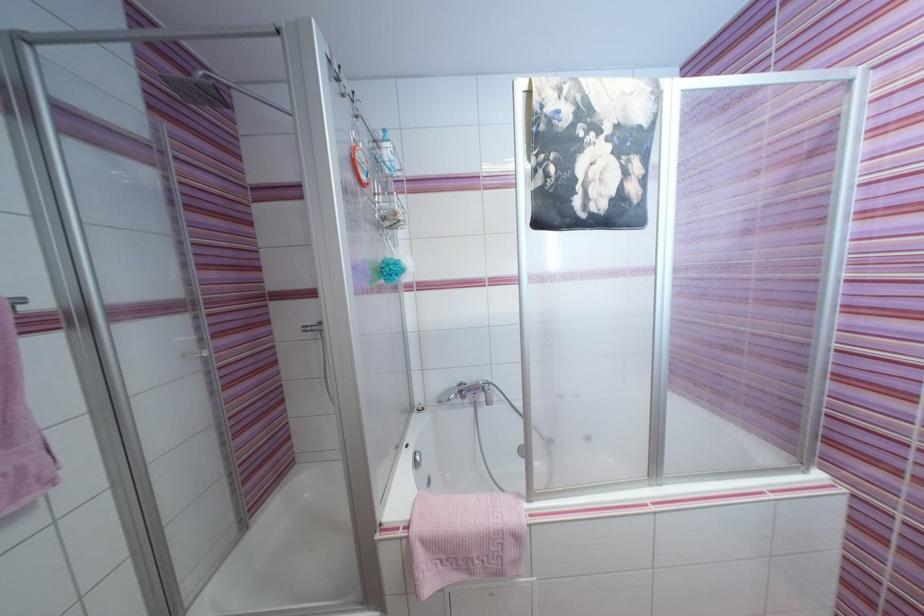
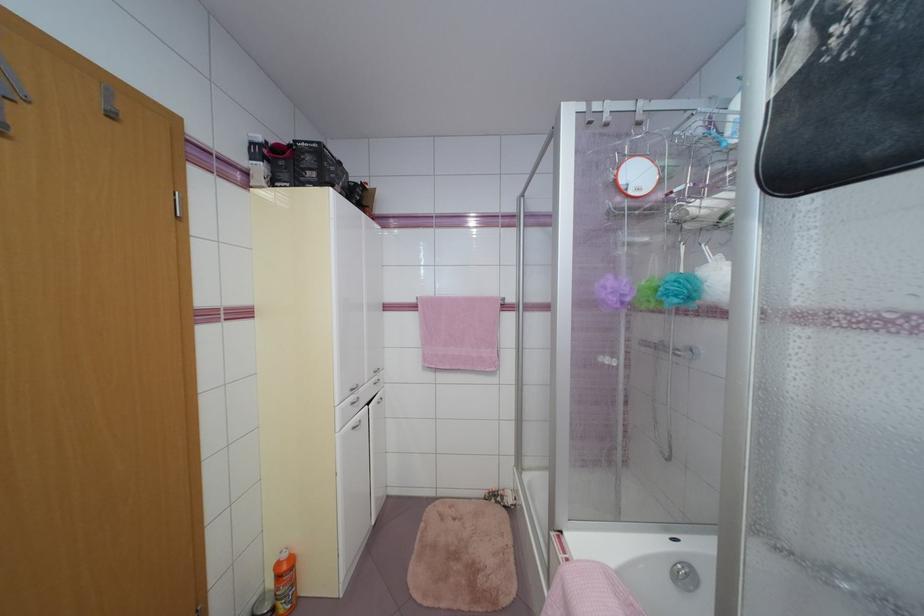
Question: The camera is either moving clockwise (left) or counter-clockwise (right) around the object. The first image is from the beginning of the video and the second image is from the end. Is the camera moving left or right when shooting the video?

Choices:
 (A) Left
 (B) Right

Answer: (B)